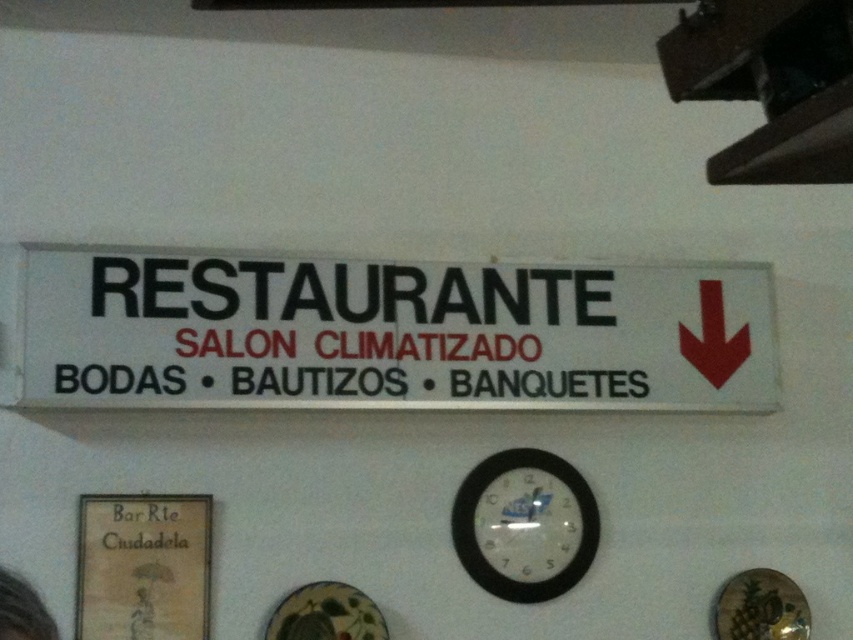
Question: Which point appears farthest from the camera in this image?

Choices:
 (A) (x=73, y=362)
 (B) (x=102, y=625)
 (C) (x=474, y=497)

Answer: (C)

Question: Among these objects, which one is farthest from the camera?

Choices:
 (A) white plastic sign at center
 (B) black plastic clock at center

Answer: (B)

Question: Is white plastic sign at center to the left of matte paper sign at center from the viewer's perspective?

Choices:
 (A) no
 (B) yes

Answer: (A)

Question: Does matte paper sign at center have a lesser width compared to black plastic clock at center?

Choices:
 (A) no
 (B) yes

Answer: (B)

Question: Is white plastic sign at center in front of matte paper sign at center?

Choices:
 (A) no
 (B) yes

Answer: (A)

Question: Which is farther from the white plastic sign at center?

Choices:
 (A) black plastic clock at center
 (B) matte paper sign at center

Answer: (B)